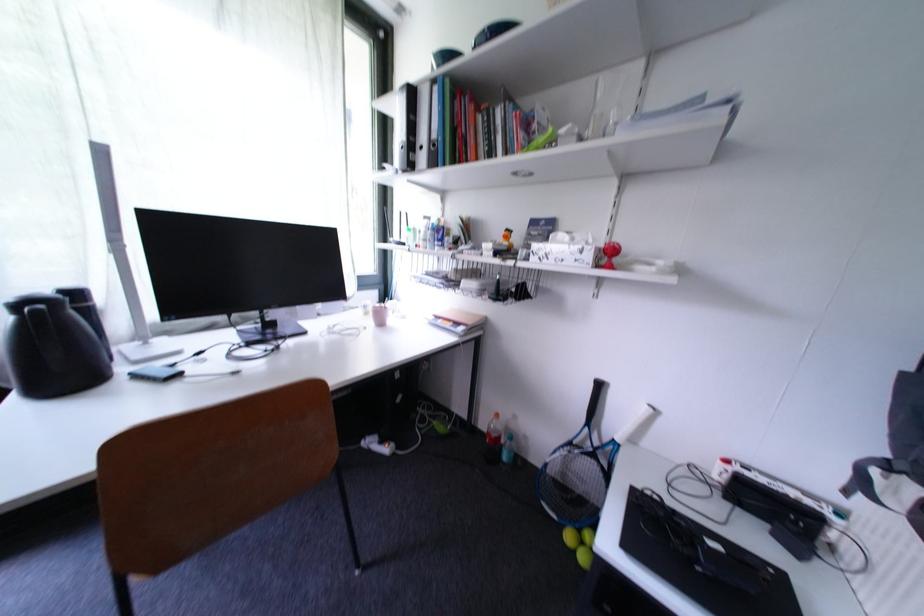
This screenshot has height=616, width=924. I want to click on white tennis racket handle, so click(x=637, y=422).